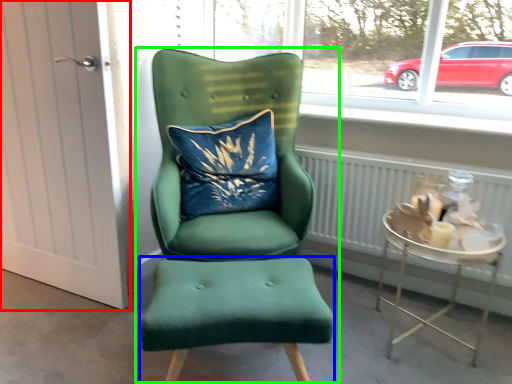
Question: Which object is positioned closest to door (highlighted by a red box)? Select from stool (highlighted by a blue box) and chair (highlighted by a green box).

Choices:
 (A) stool
 (B) chair

Answer: (B)